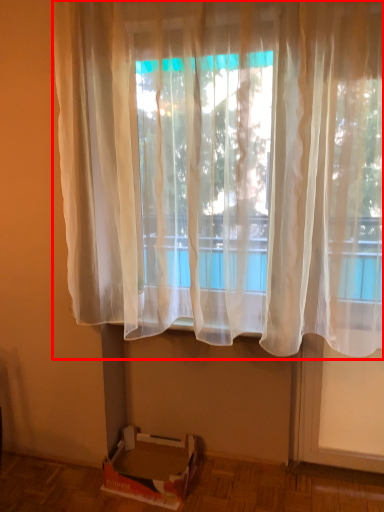
Question: In this image, where is curtain (annotated by the red box) located relative to cardboard box?

Choices:
 (A) left
 (B) right

Answer: (B)